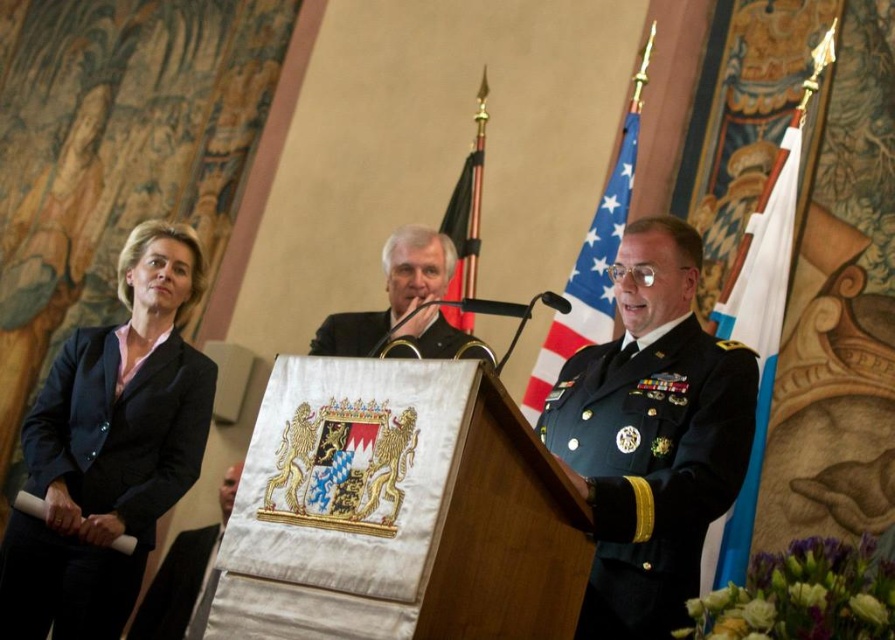
You are attending the event and need to locate the dark suit at center and the silk flag at center. Based on their positions, which object is closer to the ground?

The dark suit at center is positioned under the silk flag at center, so the dark suit at center is closer to the ground.

You are attending this formal event and need to approach the podium. From your current position, which individual is closer to the podium? The green military uniform at center or the navy blue fabric suit at left?

The green military uniform at center is closer to the podium because it is positioned below the navy blue fabric suit at left, meaning it is in a lower, forward position relative to the podium.

You are standing at the center of the room facing the podium. Which direction should you look to see the navy blue fabric suit at left?

You should look to your left to see the navy blue fabric suit at left since it is positioned at the left side of the scene.